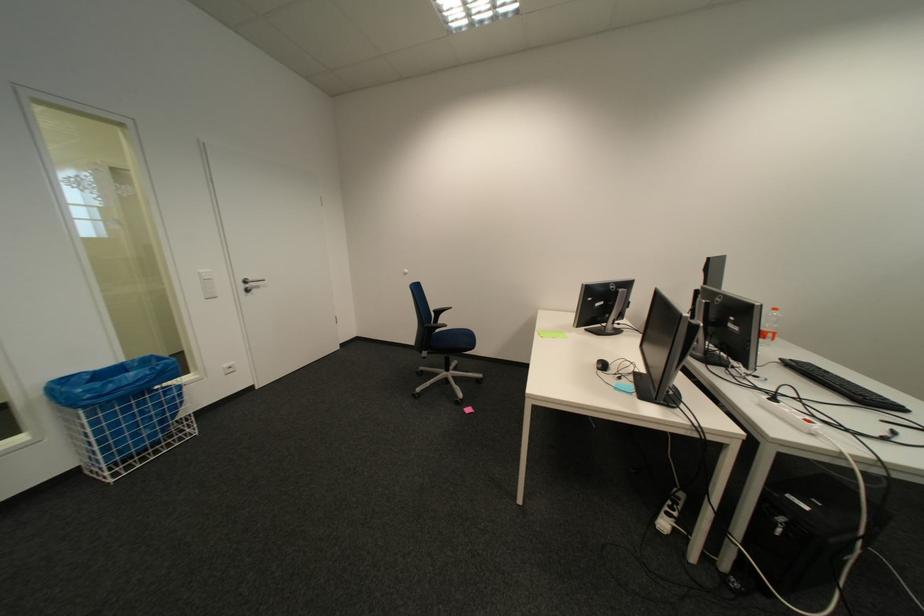
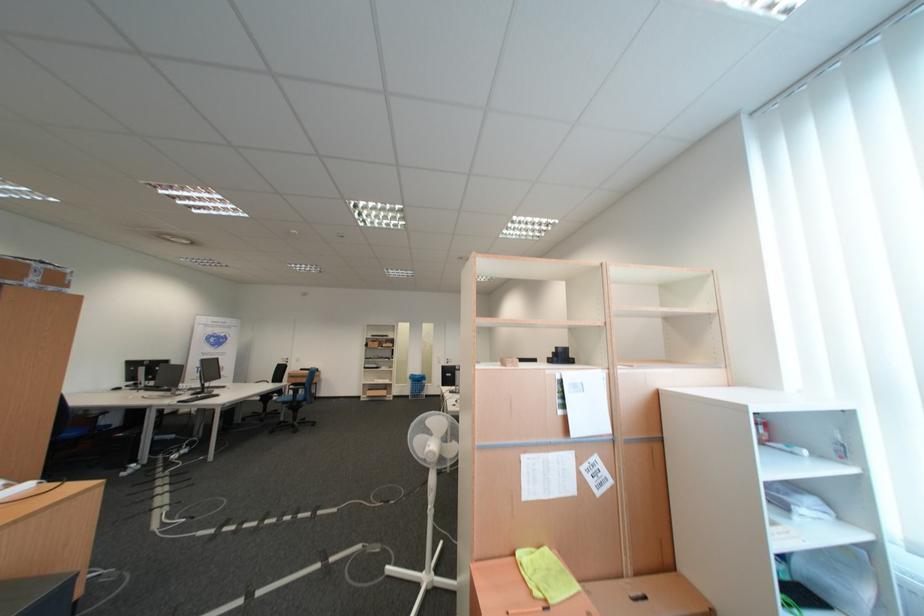
Find the pixel in the second image that matches point (120, 459) in the first image.

(422, 394)